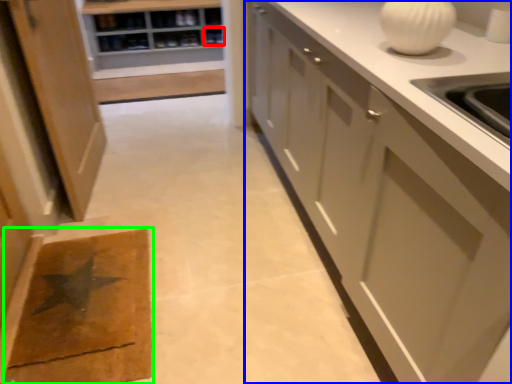
Question: Estimate the real-world distances between objects in this image. Which object is closer to shelf (highlighted by a red box), cabinetry (highlighted by a blue box) or doormat (highlighted by a green box)?

Choices:
 (A) cabinetry
 (B) doormat

Answer: (A)